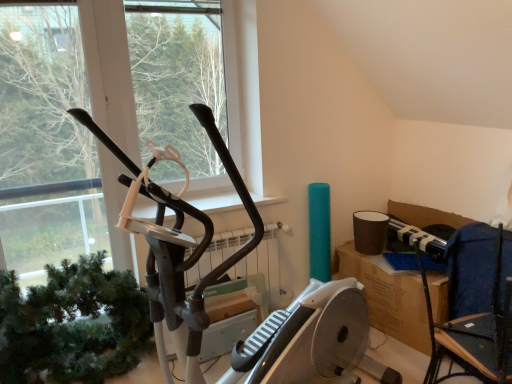
Question: Would you say dark blue fabric chair at right is a long distance from green matte plant at left?

Choices:
 (A) yes
 (B) no

Answer: (A)

Question: Can green matte plant at left be found inside dark blue fabric chair at right?

Choices:
 (A) no
 (B) yes

Answer: (A)

Question: Is dark blue fabric chair at right outside of green matte plant at left?

Choices:
 (A) no
 (B) yes

Answer: (B)

Question: Is dark blue fabric chair at right taller than green matte plant at left?

Choices:
 (A) no
 (B) yes

Answer: (B)

Question: Is dark blue fabric chair at right next to green matte plant at left and touching it?

Choices:
 (A) no
 (B) yes

Answer: (A)

Question: Is dark blue fabric chair at right in front of green matte plant at left?

Choices:
 (A) yes
 (B) no

Answer: (A)

Question: Could you tell me if black matte stationary bicycle at left is facing green matte plant at left?

Choices:
 (A) yes
 (B) no

Answer: (B)

Question: Does black matte stationary bicycle at left have a lesser width compared to green matte plant at left?

Choices:
 (A) no
 (B) yes

Answer: (A)

Question: Is green matte plant at left completely or partially inside black matte stationary bicycle at left?

Choices:
 (A) yes
 (B) no

Answer: (B)

Question: Is black matte stationary bicycle at left not close to green matte plant at left?

Choices:
 (A) no
 (B) yes

Answer: (A)

Question: From the image's perspective, does black matte stationary bicycle at left appear lower than green matte plant at left?

Choices:
 (A) no
 (B) yes

Answer: (A)

Question: Is green matte plant at left at the back of black matte stationary bicycle at left?

Choices:
 (A) no
 (B) yes

Answer: (A)

Question: Does black matte elliptical machine at center lie behind dark blue fabric chair at right?

Choices:
 (A) no
 (B) yes

Answer: (B)